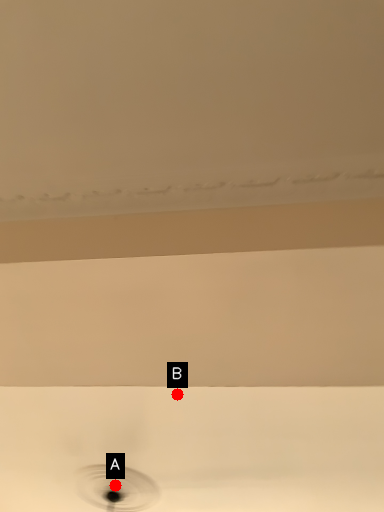
Question: Two points are circled on the image, labeled by A and B beside each circle. Which of the following is the closest to the observer?

Choices:
 (A) A is closer
 (B) B is closer

Answer: (B)